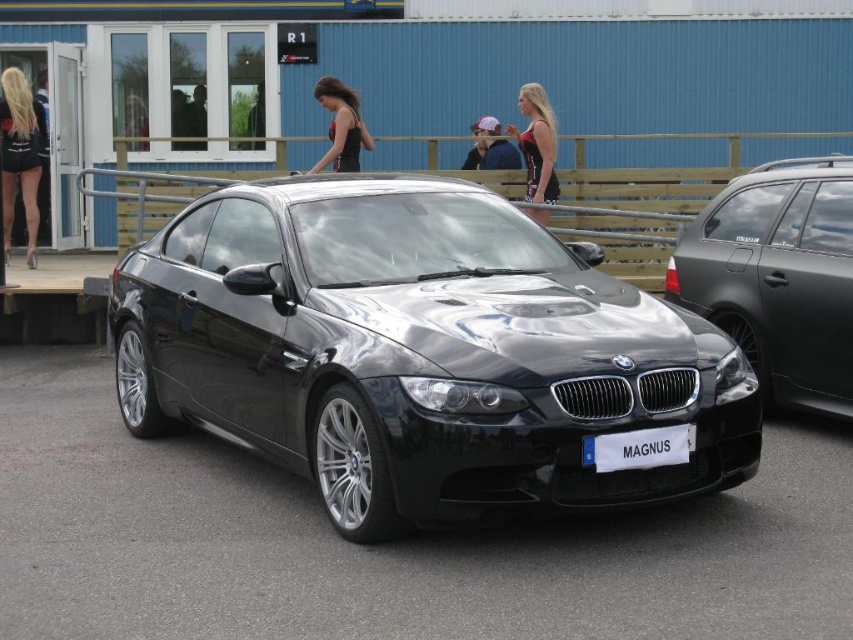
Question: From the image, what is the correct spatial relationship of shiny black car at center in relation to white plastic license plate at center?

Choices:
 (A) above
 (B) below

Answer: (A)

Question: Which point is closer to the camera?

Choices:
 (A) white plastic license plate at center
 (B) shiny black car at center
 (C) black mesh tank top at center

Answer: (B)

Question: Which of the following is the closest to the observer?

Choices:
 (A) (686, 454)
 (B) (520, 86)
 (C) (26, 177)
 (D) (723, 369)

Answer: (A)

Question: Is shiny black car at center above blonde hair at left?

Choices:
 (A) yes
 (B) no

Answer: (B)

Question: Does shiny black car at center have a greater width compared to blonde hair at left?

Choices:
 (A) yes
 (B) no

Answer: (A)

Question: Which point is closer to the camera taking this photo?

Choices:
 (A) (741, 205)
 (B) (635, 317)
 (C) (608, 456)

Answer: (C)